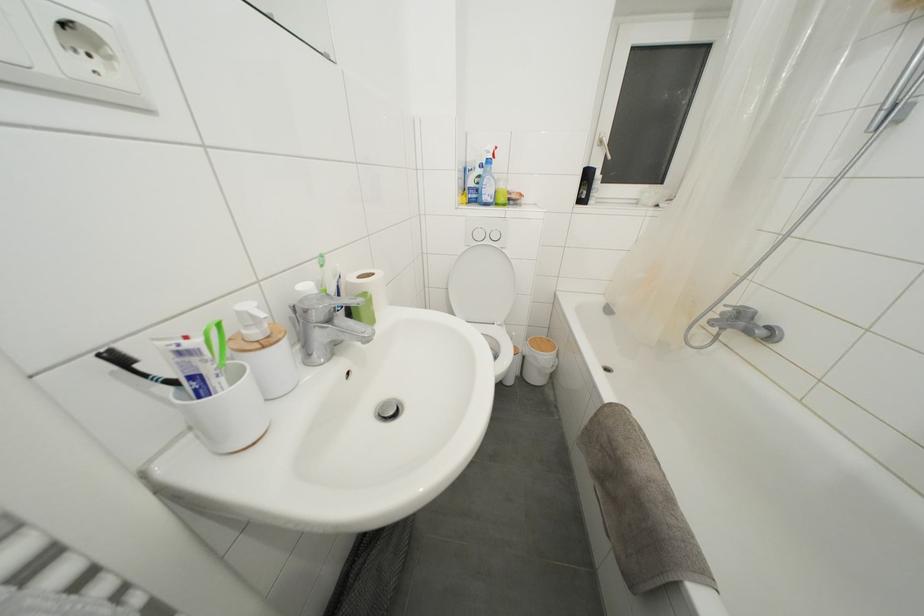
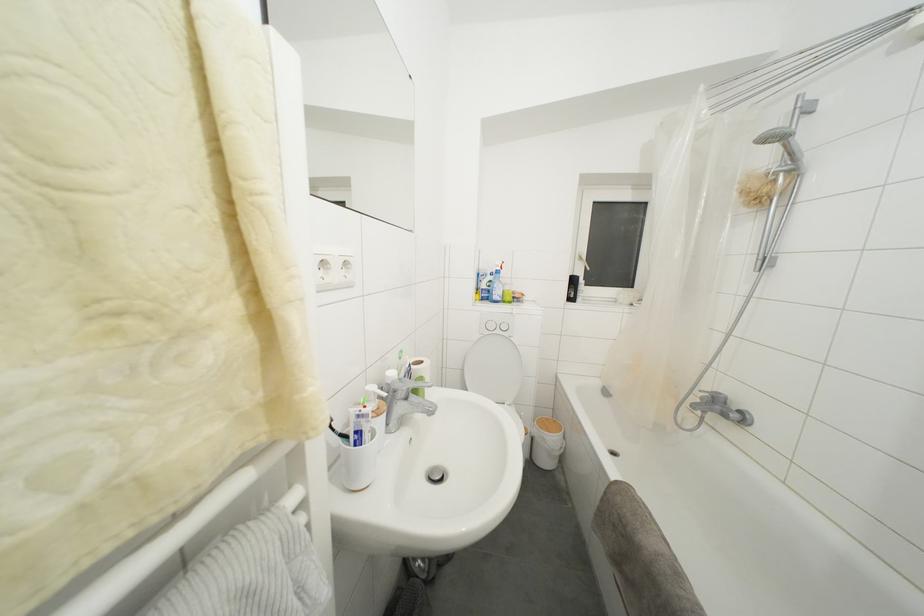
Find the pixel in the second image that matches point 611,406 in the first image.

(617, 484)